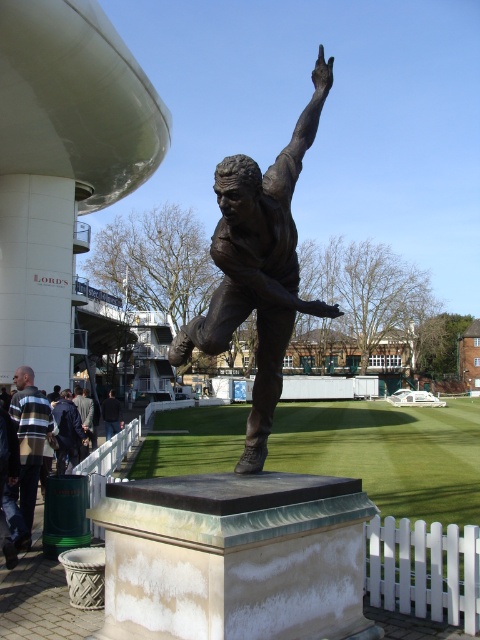
Who is more forward, (264, 444) or (78, 406)?

Positioned in front is point (264, 444).

Who is positioned more to the right, bronze statue at center or dark brown leather jacket at lower left?

Positioned to the right is bronze statue at center.

Image resolution: width=480 pixels, height=640 pixels. I want to click on bronze statue at center, so click(259, 268).

Identify the location of bronze statue at center. (259, 268).

Looking at this image, between dark brown leather jacket at lower left and dark brown statue at center, which one is positioned higher?

dark brown leather jacket at lower left is higher up.

Is point (88, 419) behind point (118, 417)?

No, (88, 419) is closer to viewer.

Does point (79, 400) come farther from viewer compared to point (112, 394)?

No, it is in front of (112, 394).

Find the location of a particular element. Image resolution: width=480 pixels, height=640 pixels. dark brown leather jacket at lower left is located at coordinates (84, 412).

Can you confirm if bronze statue at center is positioned to the right of dark brown statue at center?

Yes, bronze statue at center is to the right of dark brown statue at center.

Does point (226, 259) lie behind point (117, 410)?

That is False.

Who is more forward, (310,109) or (103,403)?

Point (310,109)

You are a GUI agent. You are given a task and a screenshot of the screen. Output one action in this format:
    pyautogui.click(x=<x>, y=<y>)
    Task: Click on the bronze statue at center
    
    Given the screenshot: What is the action you would take?
    pyautogui.click(x=259, y=268)